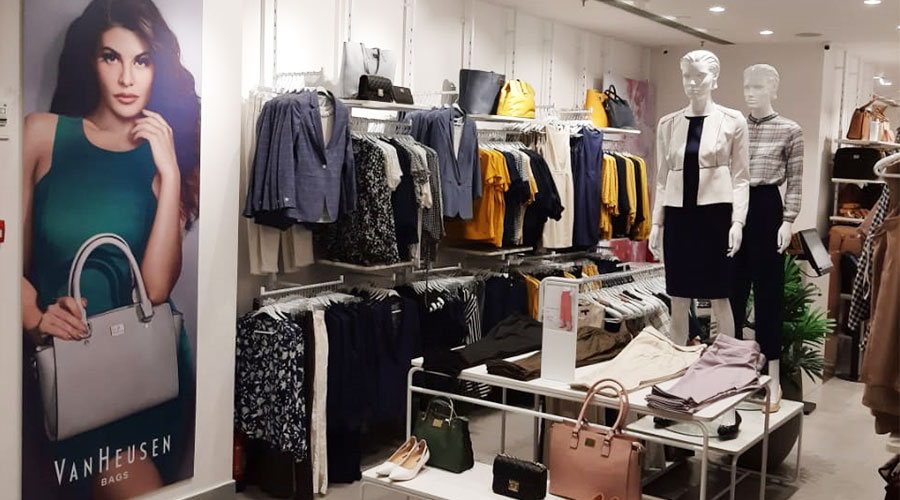
This screenshot has height=500, width=900. Identify the location of mannequin. click(706, 164), click(763, 146).